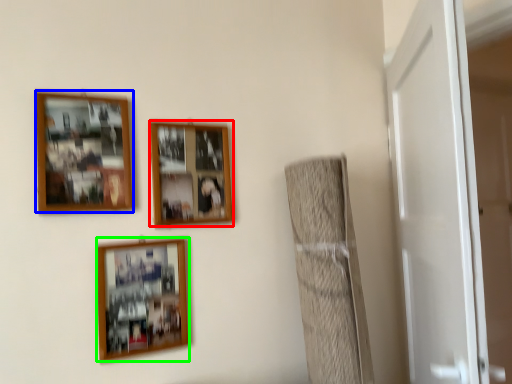
Question: Which object is positioned closest to picture frame (highlighted by a red box)? Select from picture frame (highlighted by a blue box) and picture frame (highlighted by a green box).

Choices:
 (A) picture frame
 (B) picture frame

Answer: (A)